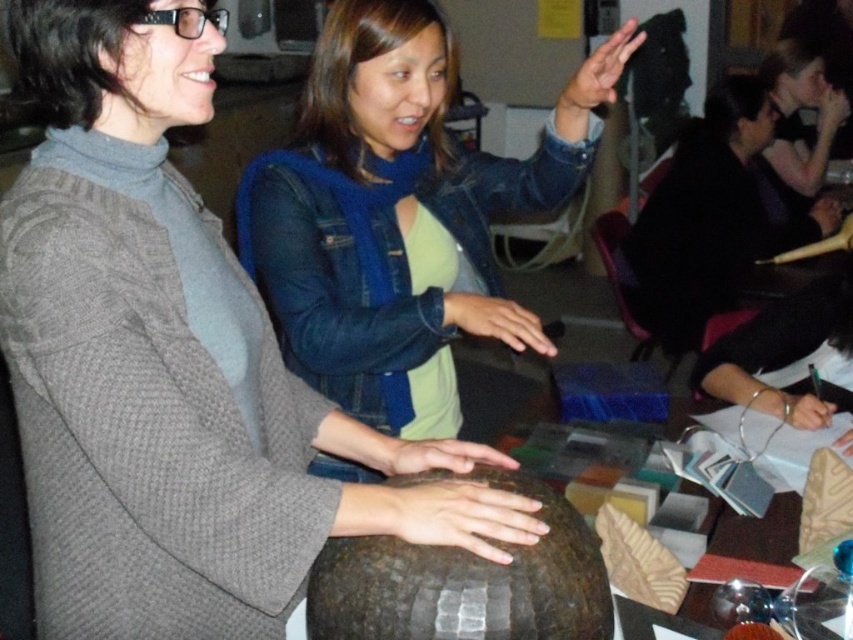
You are organizing a small event and need to place the matte brown sphere at center and the denim jacket at center on a table. Given their sizes, which object should you place first to ensure both fit comfortably?

The matte brown sphere at center occupies less space than the denim jacket at center, so you should place the denim jacket at center first to accommodate its larger size before positioning the smaller sphere.

You are standing in the scene and want to reach the point at coordinates point (312,61). If your arm can reach up to 3 feet, can you reach it without moving your feet?

The distance of point (312,61) from camera is 5.03 feet, so you cannot reach it with an arm reach of 3 feet without moving your feet.

You are standing in the scene and want to reach a point that is exactly 30 inches away from you. Is the point at coordinates point (106, 342) within your reach?

The point at point (106, 342) is 31.46 inches away from the viewer, so it is slightly out of reach since it is 1.46 inches beyond the 30 inch target distance.